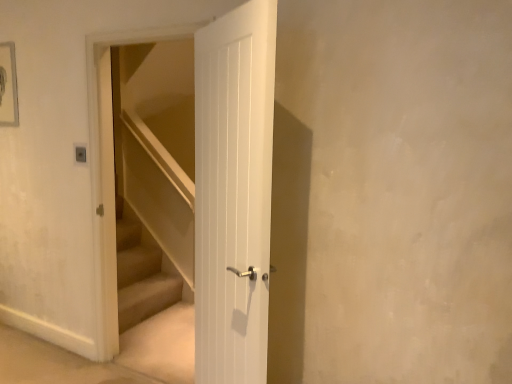
Describe the element at coordinates (220, 195) in the screenshot. Image resolution: width=512 pixels, height=384 pixels. I see `beige carpeted stairs at center` at that location.

Image resolution: width=512 pixels, height=384 pixels. Identify the location of beige carpeted stairs at center. (220, 195).

In order to face beige carpeted stairs at center, should I rotate leftwards or rightwards?

To align with it, rotate left about 13.776°.

At what (x,y) coordinates should I click in order to perform the action: click on beige carpeted stairs at center. Please return your answer as a coordinate pair (x, y). Image resolution: width=512 pixels, height=384 pixels. Looking at the image, I should click on [x=220, y=195].